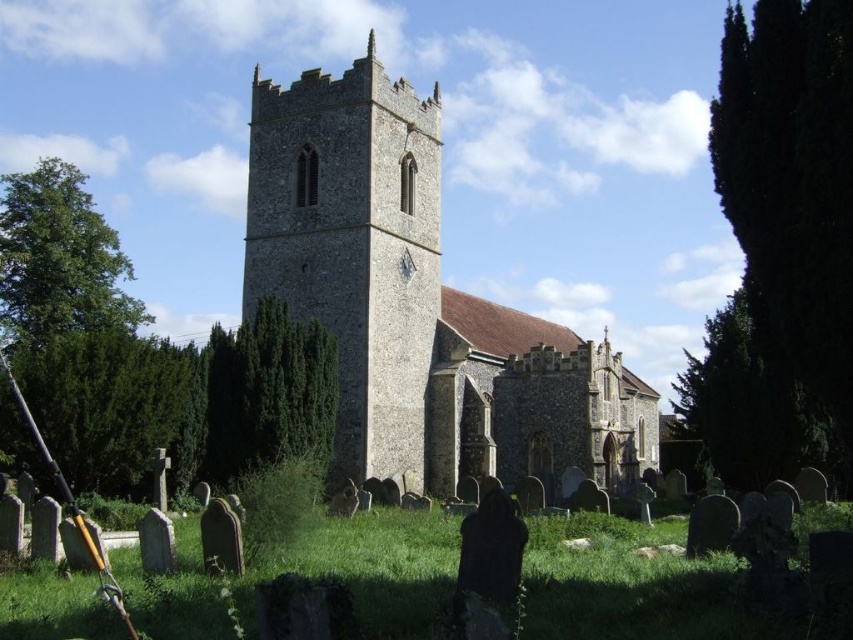
Who is more forward, [567,365] or [283,147]?

Point [283,147]

At what (x,y) coordinates should I click in order to perform the action: click on brown stone church at center. Please return your answer as a coordinate pair (x, y). Looking at the image, I should click on pyautogui.click(x=416, y=301).